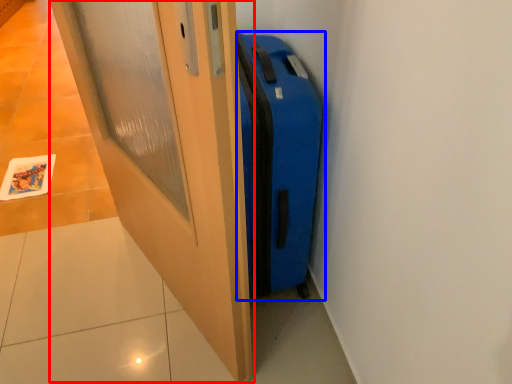
Question: Which object is closer to the camera taking this photo, door (highlighted by a red box) or suitcase (highlighted by a blue box)?

Choices:
 (A) door
 (B) suitcase

Answer: (A)